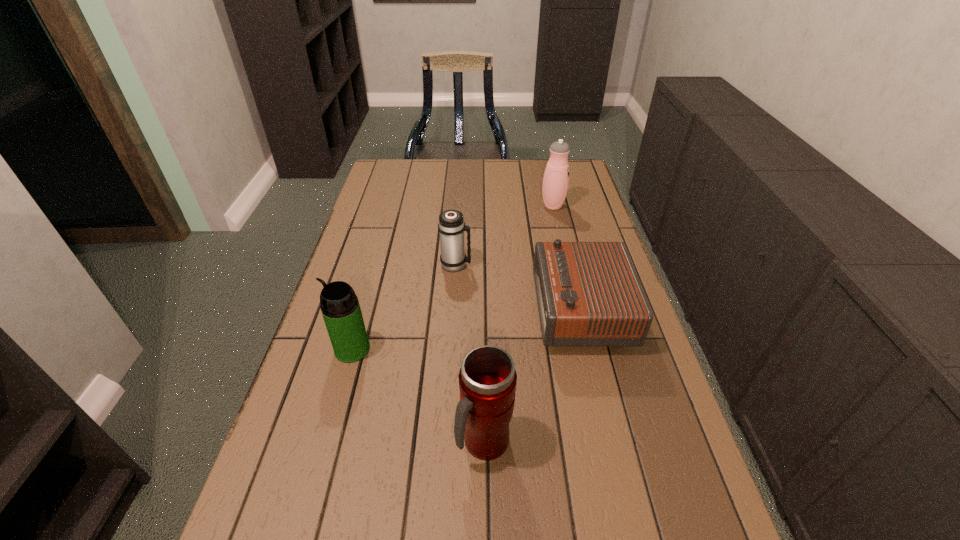
Where is `the farthest thermos bottle`? The width and height of the screenshot is (960, 540). the farthest thermos bottle is located at coordinates (555, 184).

Locate an element on the screen. the farthest object is located at coordinates (555, 184).

At what (x,y) coordinates should I click in order to perform the action: click on the nearest thermos bottle. Please return your answer as a coordinate pair (x, y). Image resolution: width=960 pixels, height=540 pixels. Looking at the image, I should click on (487, 378).

In order to click on the leftmost object in this screenshot , I will do `click(341, 311)`.

Image resolution: width=960 pixels, height=540 pixels. I want to click on the second nearest thermos bottle, so click(x=341, y=311).

This screenshot has height=540, width=960. I want to click on the second farthest object, so (451, 226).

Find the location of `the second farthest thermos bottle`. the second farthest thermos bottle is located at coordinates (451, 226).

You are a GUI agent. You are given a task and a screenshot of the screen. Output one action in this format:
    pyautogui.click(x=<x>, y=<y>)
    Task: Click on the radio receiver
    
    Given the screenshot: What is the action you would take?
    pyautogui.click(x=588, y=293)

At what (x,y) coordinates should I click in order to perform the action: click on vacant space located on the back of the rightmost thermos bottle. Please return your answer as a coordinate pair (x, y). Image resolution: width=960 pixels, height=540 pixels. Looking at the image, I should click on [x=542, y=160].

Identify the location of free region located on the side with the handle of the nearest object. This screenshot has height=540, width=960. (485, 504).